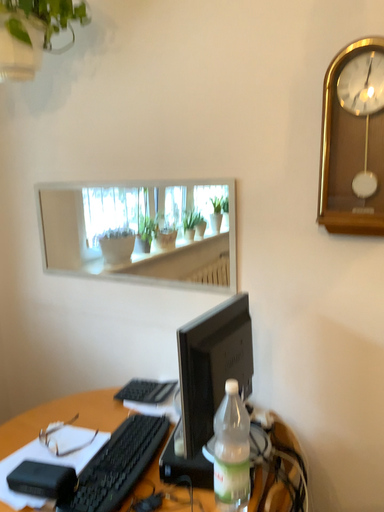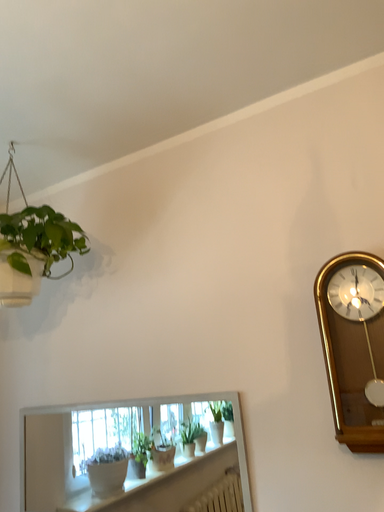
Question: Which way did the camera rotate in the video?

Choices:
 (A) rotated downward
 (B) rotated upward

Answer: (B)